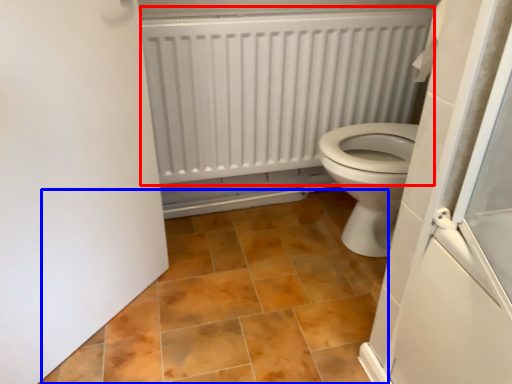
Question: Which object is further to the camera taking this photo, radiator (highlighted by a red box) or ceramic tile (highlighted by a blue box)?

Choices:
 (A) radiator
 (B) ceramic tile

Answer: (A)